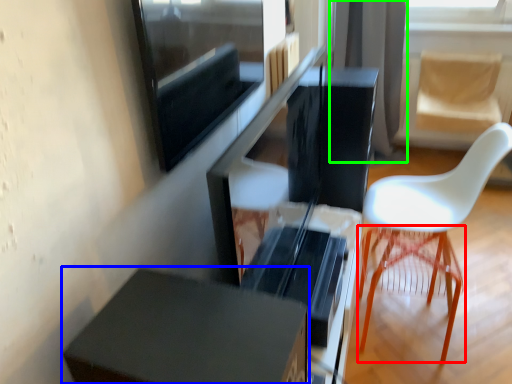
Question: Considering the real-world distances, which object is farthest from bar stool (highlighted by a red box)? furniture (highlighted by a blue box) or curtain (highlighted by a green box)?

Choices:
 (A) furniture
 (B) curtain

Answer: (B)